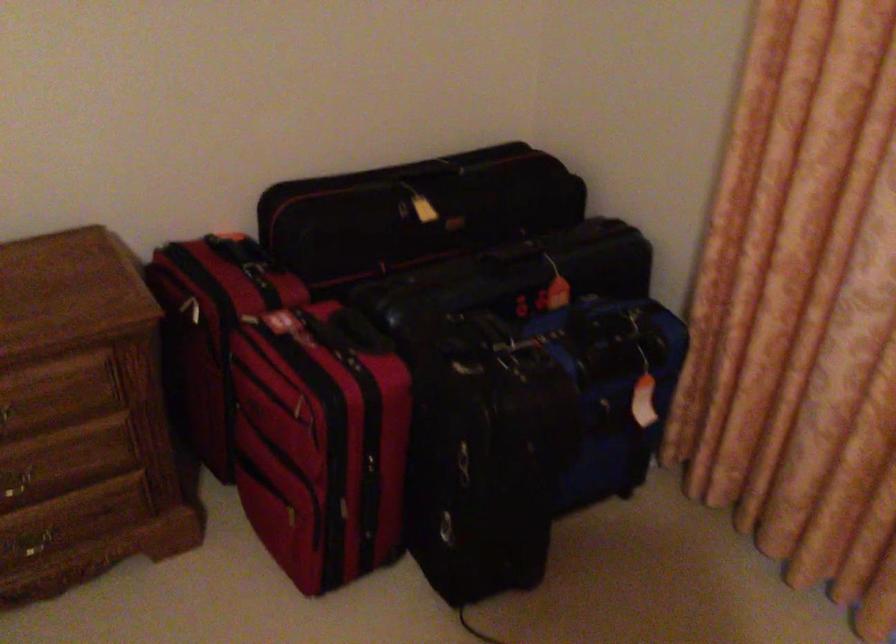
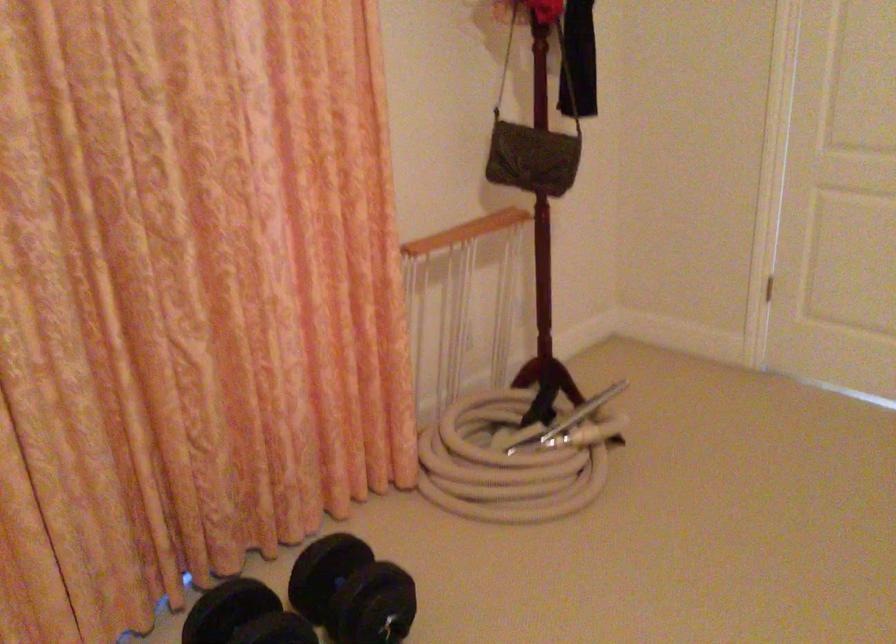
How did the camera likely rotate?

The rotation direction of the camera is right-down.